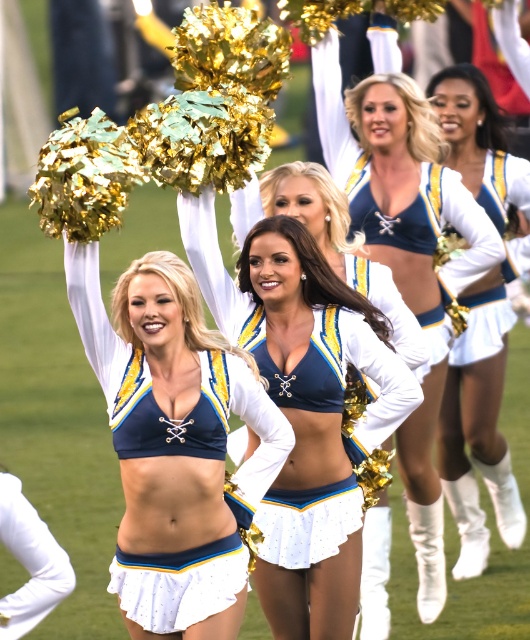
Question: Which point appears farthest from the camera in this image?

Choices:
 (A) (481, 321)
 (B) (19, 492)
 (C) (428, 307)

Answer: (A)

Question: Is matte blue bikini top at center smaller than white matte uniform at lower left?

Choices:
 (A) yes
 (B) no

Answer: (B)

Question: Does blue satin cheerleader at center have a lesser width compared to white matte uniform at center?

Choices:
 (A) no
 (B) yes

Answer: (A)

Question: Which of the following is the farthest from the observer?

Choices:
 (A) matte blue bikini top at center
 (B) white matte uniform at lower left
 (C) matte blue fabric top at center

Answer: (C)

Question: Which of the following is the closest to the observer?

Choices:
 (A) matte blue bikini top at center
 (B) matte blue fabric top at center

Answer: (A)

Question: Does white matte uniform at center have a smaller size compared to white matte uniform at lower left?

Choices:
 (A) yes
 (B) no

Answer: (B)